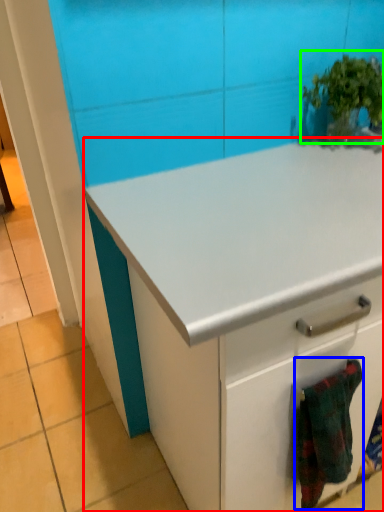
Question: Which object is positioned closest to cabinetry (highlighted by a red box)? Select from blanket (highlighted by a blue box) and houseplant (highlighted by a green box).

Choices:
 (A) blanket
 (B) houseplant

Answer: (A)